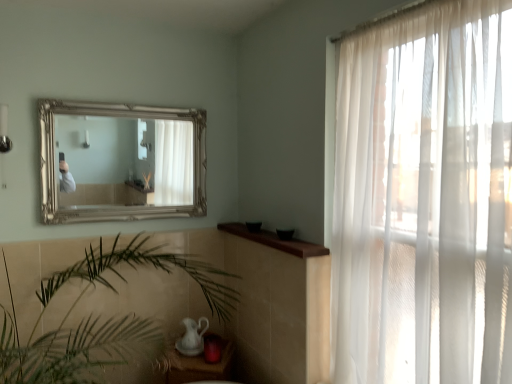
Question: From the image's perspective, is white glossy tea pot at lower center located above or below matte white table at lower center?

Choices:
 (A) below
 (B) above

Answer: (B)

Question: Looking at their shapes, would you say white glossy tea pot at lower center is wider or thinner than matte white table at lower center?

Choices:
 (A) wide
 (B) thin

Answer: (B)

Question: Which object is the farthest from the green leafy plant at center?

Choices:
 (A) white glossy tea pot at lower center
 (B) gold metallic mirror at upper center
 (C) brown wood window sill at center
 (D) sheer white curtain at right
 (E) matte white table at lower center

Answer: (D)

Question: Which of these objects is positioned closest to the gold metallic mirror at upper center?

Choices:
 (A) green leafy plant at center
 (B) white glossy tea pot at lower center
 (C) sheer white curtain at right
 (D) brown wood window sill at center
 (E) matte white table at lower center

Answer: (A)